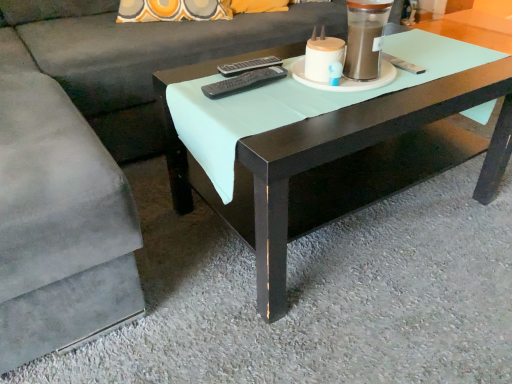
Question: Can we say black plastic remote at center, the 2th remote viewed from the back, lies outside black plastic remote at center, which is the 1th remote in back-to-front order?

Choices:
 (A) no
 (B) yes

Answer: (B)

Question: Would you consider black plastic remote at center, marked as the first remote in a front-to-back arrangement, to be distant from black plastic remote at center, the 2th remote viewed from the front?

Choices:
 (A) no
 (B) yes

Answer: (A)

Question: From the image's perspective, is black plastic remote at center, the 2th remote viewed from the back, on top of black plastic remote at center, the 2th remote viewed from the front?

Choices:
 (A) yes
 (B) no

Answer: (B)

Question: From a real-world perspective, is black plastic remote at center, marked as the first remote in a front-to-back arrangement, located higher than black plastic remote at center, which is the 1th remote in back-to-front order?

Choices:
 (A) yes
 (B) no

Answer: (A)

Question: Does black plastic remote at center, marked as the first remote in a front-to-back arrangement, have a lesser height compared to black plastic remote at center, the 2th remote viewed from the front?

Choices:
 (A) yes
 (B) no

Answer: (B)

Question: Considering the positions of black plastic remote at center, which is the 1th remote in back-to-front order, and suede gray couch at center in the image, is black plastic remote at center, which is the 1th remote in back-to-front order, wider or thinner than suede gray couch at center?

Choices:
 (A) thin
 (B) wide

Answer: (A)

Question: Considering the positions of black plastic remote at center, which is the 1th remote in back-to-front order, and suede gray couch at center in the image, is black plastic remote at center, which is the 1th remote in back-to-front order, taller or shorter than suede gray couch at center?

Choices:
 (A) tall
 (B) short

Answer: (B)

Question: In the image, is black plastic remote at center, the 2th remote viewed from the front, on the left side or the right side of suede gray couch at center?

Choices:
 (A) right
 (B) left

Answer: (A)

Question: Looking at the image, does black plastic remote at center, which is the 1th remote in back-to-front order, seem bigger or smaller compared to suede gray couch at center?

Choices:
 (A) small
 (B) big

Answer: (A)

Question: From their relative heights in the image, would you say black plastic remote at center, marked as the first remote in a front-to-back arrangement, is taller or shorter than suede gray couch at center?

Choices:
 (A) tall
 (B) short

Answer: (B)

Question: From a real-world perspective, is black plastic remote at center, the 2th remote viewed from the back, above or below suede gray couch at center?

Choices:
 (A) above
 (B) below

Answer: (A)

Question: Considering the relative positions of black plastic remote at center, marked as the first remote in a front-to-back arrangement, and suede gray couch at center in the image provided, is black plastic remote at center, marked as the first remote in a front-to-back arrangement, to the left or to the right of suede gray couch at center?

Choices:
 (A) left
 (B) right

Answer: (B)

Question: Is black plastic remote at center, marked as the first remote in a front-to-back arrangement, in front of or behind suede gray couch at center in the image?

Choices:
 (A) behind
 (B) front

Answer: (A)

Question: In terms of size, does matte white candle holder at upper center appear bigger or smaller than black plastic remote at center, the 2th remote viewed from the back?

Choices:
 (A) big
 (B) small

Answer: (A)

Question: Considering the positions of point (360, 59) and point (268, 74), is point (360, 59) closer or farther from the camera than point (268, 74)?

Choices:
 (A) closer
 (B) farther

Answer: (A)